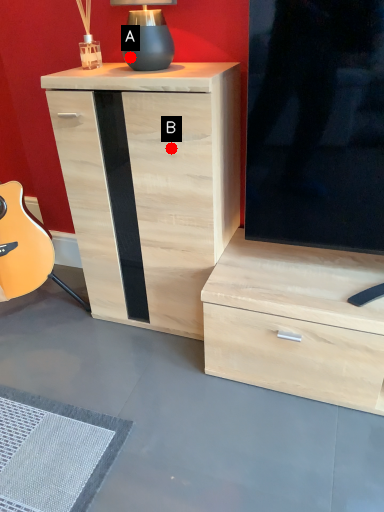
Question: Two points are circled on the image, labeled by A and B beside each circle. Which point is closer to the camera?

Choices:
 (A) A is closer
 (B) B is closer

Answer: (B)